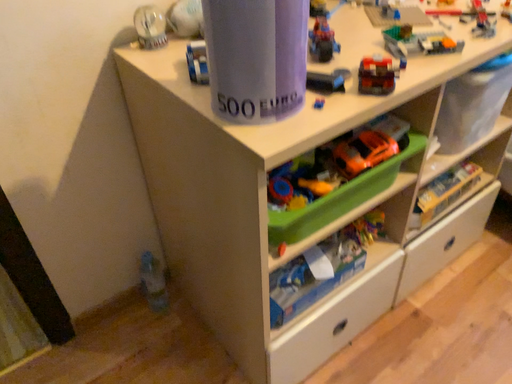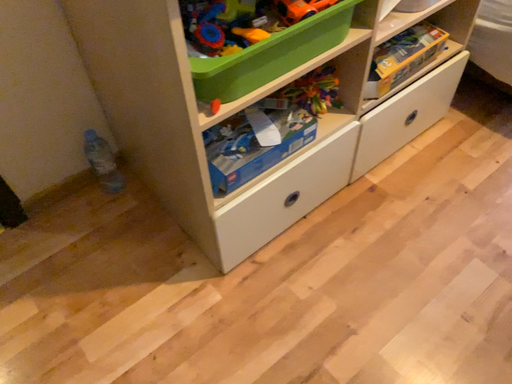
Question: How did the camera likely rotate when shooting the video?

Choices:
 (A) rotated downward
 (B) rotated upward

Answer: (A)